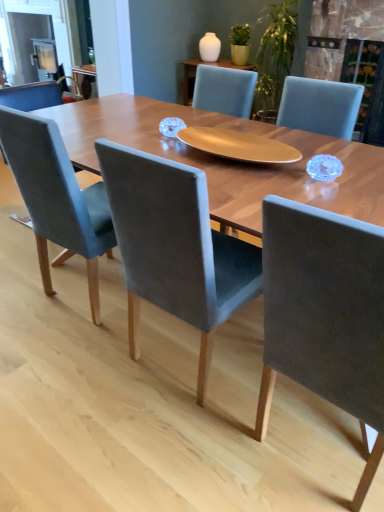
This screenshot has height=512, width=384. I want to click on vacant area situated below velvet grey chair at center, marked as the second chair in a right-to-left arrangement (from a real-world perspective), so click(182, 359).